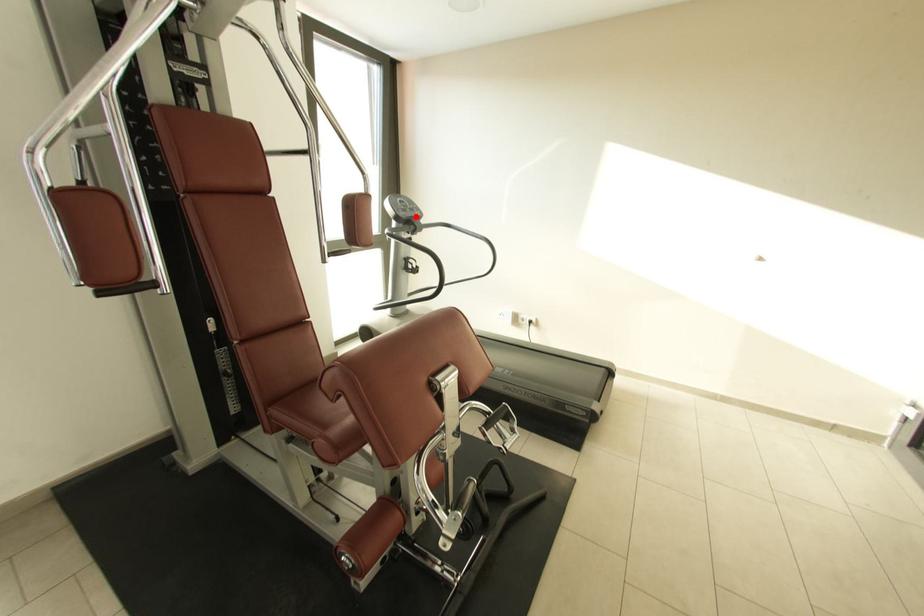
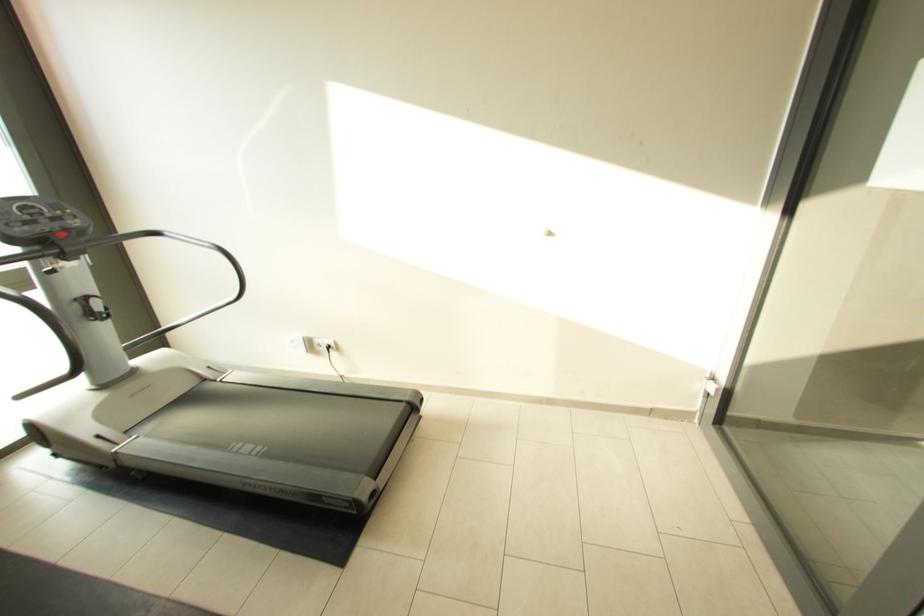
In the second image, find the point that corresponds to the highlighted location in the first image.

(54, 232)